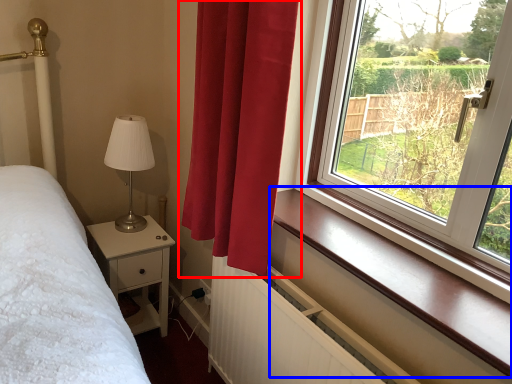
Question: Which of the following is the farthest to the observer, curtain (highlighted by a red box) or window sill (highlighted by a blue box)?

Choices:
 (A) curtain
 (B) window sill

Answer: (A)